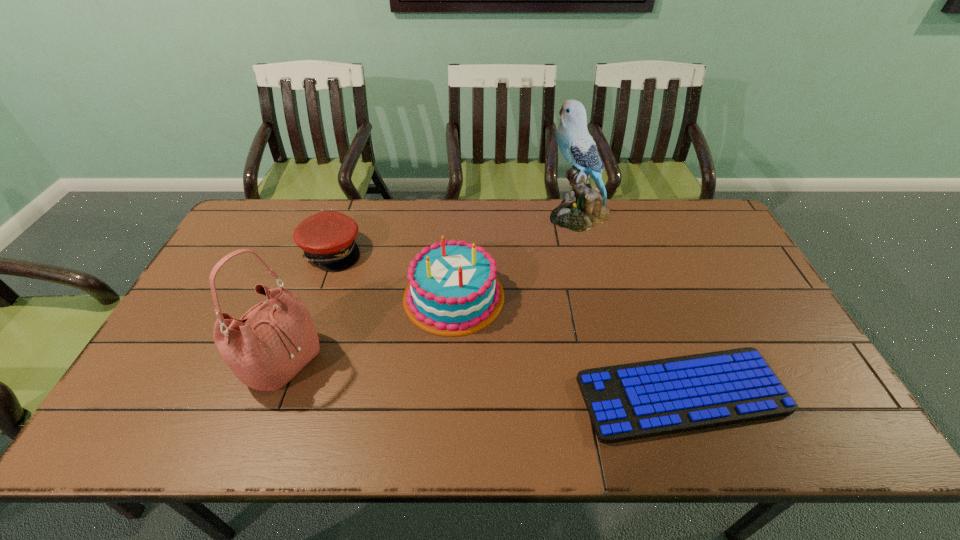
Image resolution: width=960 pixels, height=540 pixels. I want to click on vacant point located between the fourth tallest object and the third object from right to left, so click(393, 274).

What are the coordinates of `free spot between the computer keyboard and the birthday cake` in the screenshot? It's located at (568, 345).

This screenshot has width=960, height=540. In order to click on free space between the handbag and the third object from left to right in this screenshot , I will do `click(368, 329)`.

Find the location of `free spot between the computer keyboard and the birthday cake`. free spot between the computer keyboard and the birthday cake is located at coordinates (568, 345).

Point out which object is positioned as the nearest to the second tallest object. Please provide its 2D coordinates. Your answer should be formatted as a tuple, i.e. [(x, y)], where the tuple contains the x and y coordinates of a point satisfying the conditions above.

[(454, 290)]

Where is `the fourth closest object to the shortest object`? Image resolution: width=960 pixels, height=540 pixels. the fourth closest object to the shortest object is located at coordinates (327, 238).

Where is `vacant space that satisfies the following two spatial constraints: 1. on the front-facing side of the shortest object; 2. on the right side of the fourth tallest object`? vacant space that satisfies the following two spatial constraints: 1. on the front-facing side of the shortest object; 2. on the right side of the fourth tallest object is located at coordinates (280, 394).

I want to click on vacant area that satisfies the following two spatial constraints: 1. on the back side of the handbag; 2. on the left side of the third object from right to left, so click(307, 296).

This screenshot has width=960, height=540. I want to click on blank area in the image that satisfies the following two spatial constraints: 1. on the front-facing side of the fourth tallest object; 2. on the right side of the birthday cake, so click(x=315, y=296).

Locate an element on the screen. vacant space that satisfies the following two spatial constraints: 1. on the front-facing side of the cap; 2. on the front side of the handbag is located at coordinates (292, 362).